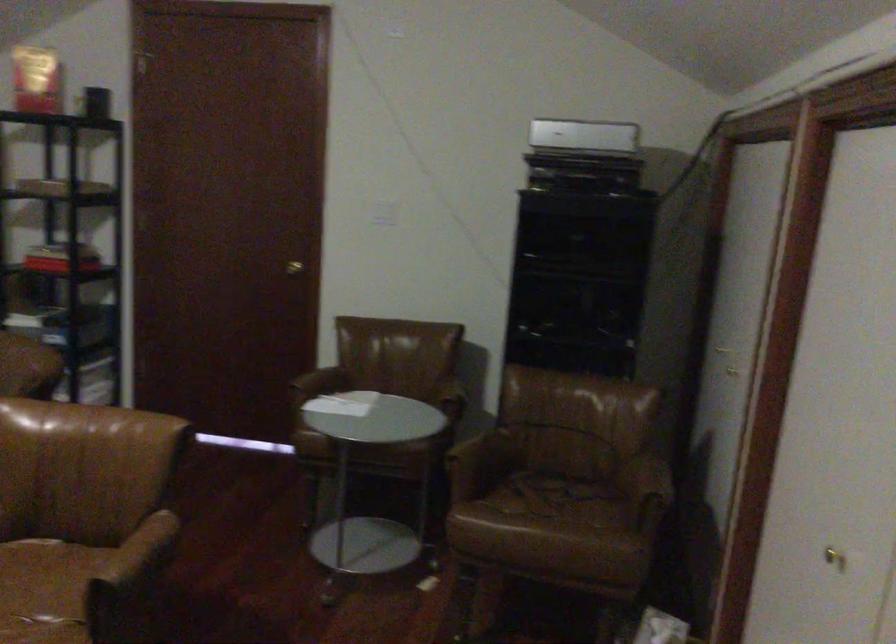
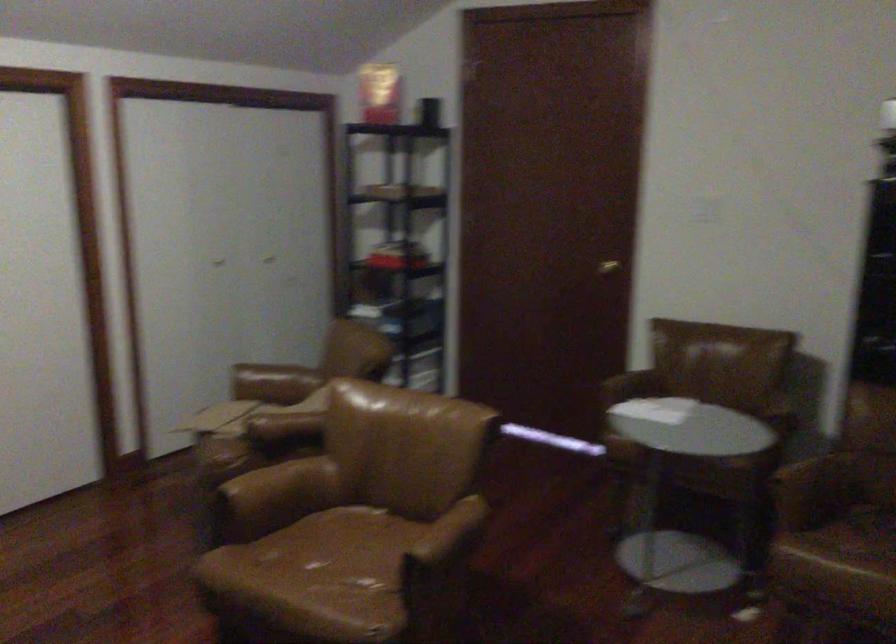
Question: The camera is either moving clockwise (left) or counter-clockwise (right) around the object. The first image is from the beginning of the video and the second image is from the end. Is the camera moving left or right when shooting the video?

Choices:
 (A) Left
 (B) Right

Answer: (B)